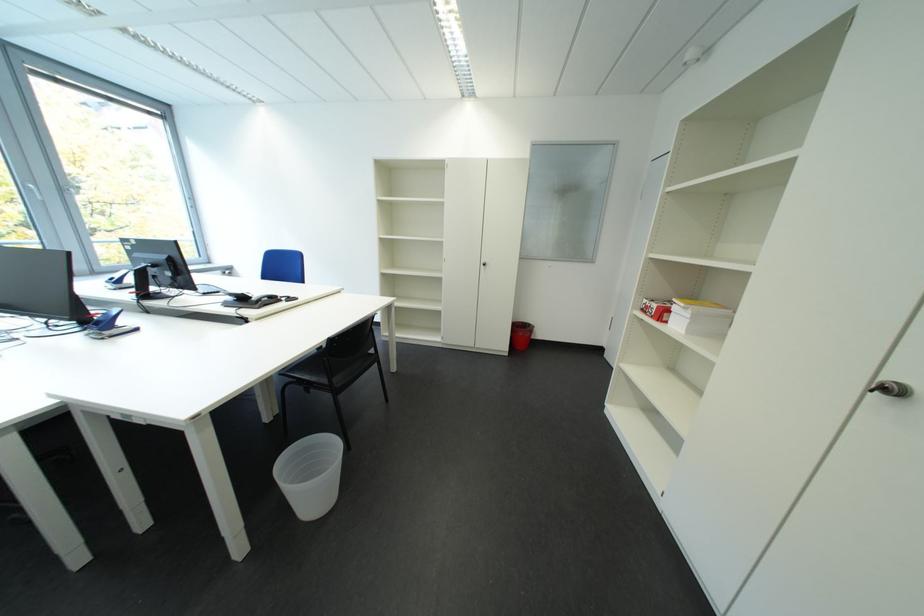
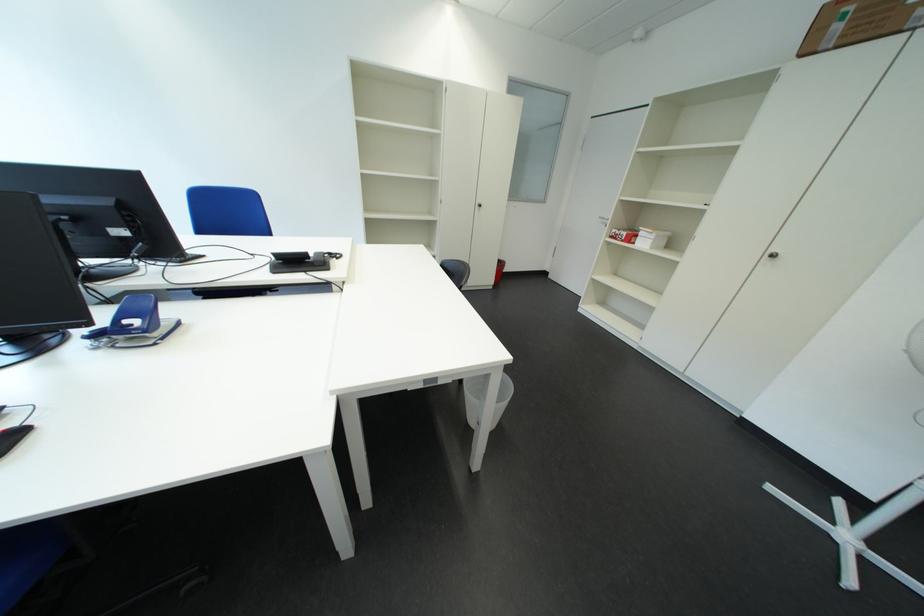
Locate, in the second image, the point that corresponds to [300,300] in the first image.

(342, 256)